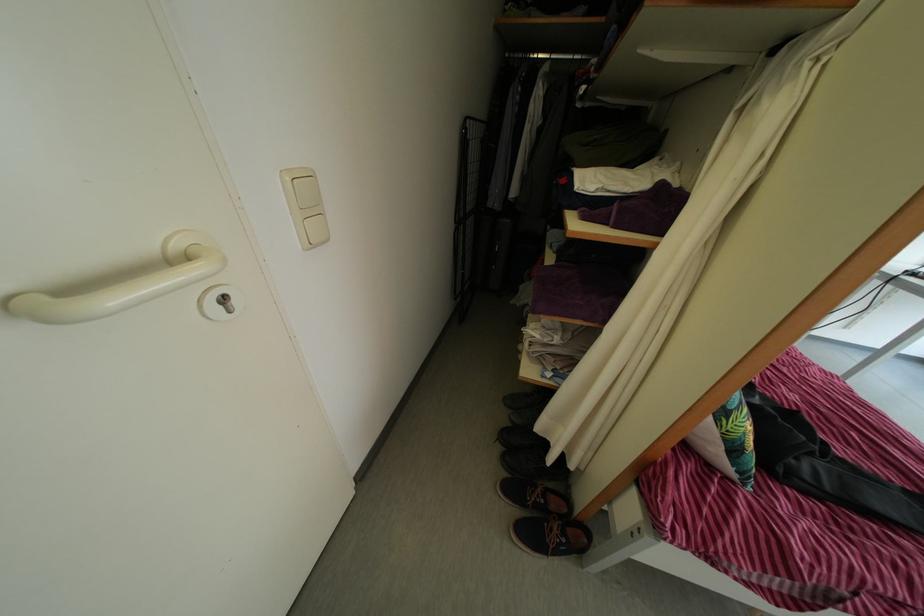
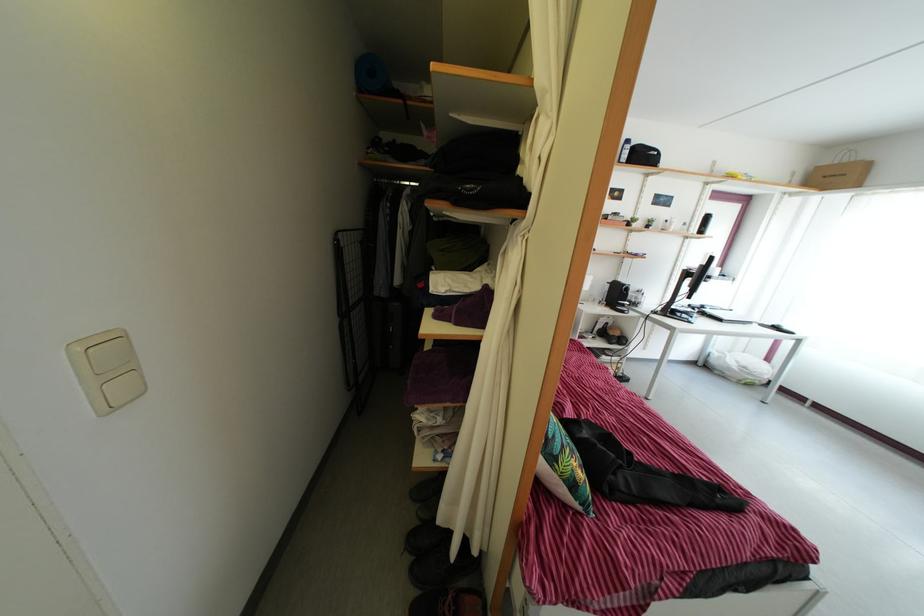
The images are taken continuously from a first-person perspective. In which direction are you moving?

The movement direction of the cameraman is right, backward.